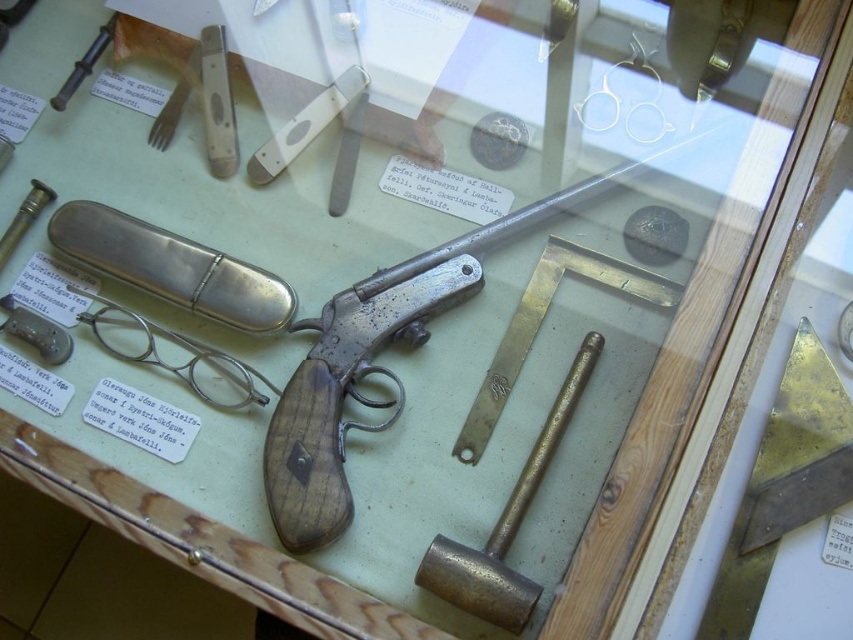
Question: Which object is the closest to the matte silver bullet at left?

Choices:
 (A) brass/metallic hammer at lower right
 (B) matte silver handgun at center

Answer: (B)

Question: Can you confirm if matte silver handgun at center is bigger than matte silver bullet at left?

Choices:
 (A) no
 (B) yes

Answer: (B)

Question: Which object is closer to the camera taking this photo?

Choices:
 (A) matte silver handgun at center
 (B) brass/metallic hammer at lower right

Answer: (B)

Question: Can you confirm if brass/metallic hammer at lower right is positioned below matte silver bullet at left?

Choices:
 (A) yes
 (B) no

Answer: (A)

Question: Which point is farther to the camera?

Choices:
 (A) matte silver bullet at left
 (B) matte silver handgun at center
 (C) brass/metallic hammer at lower right

Answer: (A)

Question: Is brass/metallic hammer at lower right closer to the viewer compared to matte silver bullet at left?

Choices:
 (A) yes
 (B) no

Answer: (A)